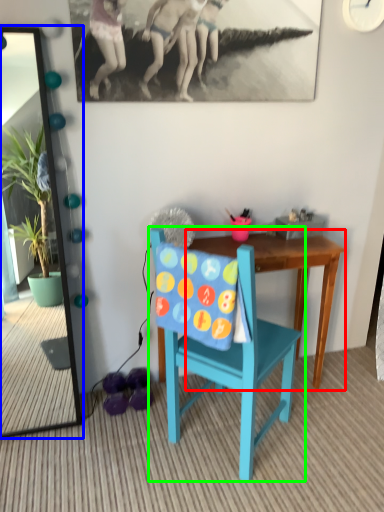
Question: Estimate the real-world distances between objects in this image. Which object is closer to table (highlighted by a red box), mirror (highlighted by a blue box) or chair (highlighted by a green box)?

Choices:
 (A) mirror
 (B) chair

Answer: (B)